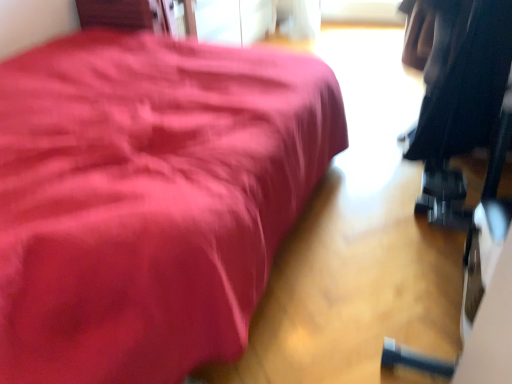
You are a GUI agent. You are given a task and a screenshot of the screen. Output one action in this format:
    pyautogui.click(x=<x>, y=<y>)
    Task: Click on the black fabric at right
    
    Given the screenshot: What is the action you would take?
    pyautogui.click(x=464, y=76)

What do you see at coordinates (464, 76) in the screenshot?
I see `black fabric at right` at bounding box center [464, 76].

What is the approximate height of matte black dumbbell at lower right?

The height of matte black dumbbell at lower right is 0.92 inches.

Find the location of `matte black dumbbell at lower right`. matte black dumbbell at lower right is located at coordinates (148, 199).

Image resolution: width=512 pixels, height=384 pixels. What do you see at coordinates (148, 199) in the screenshot?
I see `matte black dumbbell at lower right` at bounding box center [148, 199].

This screenshot has height=384, width=512. Identify the location of black fabric at right. (464, 76).

Can you confirm if black fabric at right is positioned to the right of matte black dumbbell at lower right?

Correct, you'll find black fabric at right to the right of matte black dumbbell at lower right.

Is black fabric at right positioned behind matte black dumbbell at lower right?

Yes.

Considering the positions of points (492, 29) and (82, 130), is point (492, 29) closer to camera compared to point (82, 130)?

No, it is behind (82, 130).

From the image's perspective, which one is positioned higher, black fabric at right or matte black dumbbell at lower right?

From the image's view, matte black dumbbell at lower right is above.

From a real-world perspective, between black fabric at right and matte black dumbbell at lower right, who is vertically lower?

In real-world perspective, matte black dumbbell at lower right is lower.

Which of these two, black fabric at right or matte black dumbbell at lower right, is wider?

matte black dumbbell at lower right.

Considering the sizes of black fabric at right and matte black dumbbell at lower right in the image, is black fabric at right taller or shorter than matte black dumbbell at lower right?

Clearly, black fabric at right is taller compared to matte black dumbbell at lower right.

Considering the sizes of objects black fabric at right and matte black dumbbell at lower right in the image provided, who is bigger, black fabric at right or matte black dumbbell at lower right?

With larger size is matte black dumbbell at lower right.

Which is correct: black fabric at right is inside matte black dumbbell at lower right, or outside of it?

black fabric at right is not enclosed by matte black dumbbell at lower right.

Consider the image. Is black fabric at right not close to matte black dumbbell at lower right?

black fabric at right is near matte black dumbbell at lower right, not far away.

Is black fabric at right facing away from matte black dumbbell at lower right?

No, black fabric at right's orientation is not away from matte black dumbbell at lower right.

How different are the orientations of black fabric at right and matte black dumbbell at lower right in degrees?

black fabric at right and matte black dumbbell at lower right are facing 90 degrees away from each other.

Looking at this image, how much distance is there between black fabric at right and matte black dumbbell at lower right?

They are 82.06 centimeters apart.

In order to click on clothing located behind the matte black dumbbell at lower right in this screenshot , I will do `click(464, 76)`.

Which is more to the right, matte black dumbbell at lower right or black fabric at right?

From the viewer's perspective, black fabric at right appears more on the right side.

In the image, is matte black dumbbell at lower right positioned in front of or behind black fabric at right?

In the image, matte black dumbbell at lower right appears in front of black fabric at right.

Considering the points (33, 372) and (496, 21), which point is behind, point (33, 372) or point (496, 21)?

Positioned behind is point (496, 21).

From the image's perspective, does matte black dumbbell at lower right appear lower than black fabric at right?

No.

From a real-world perspective, which is physically below, matte black dumbbell at lower right or black fabric at right?

matte black dumbbell at lower right is physically lower.

Which object is thinner, matte black dumbbell at lower right or black fabric at right?

black fabric at right is thinner.

Can you confirm if matte black dumbbell at lower right is taller than black fabric at right?

No.

Can you confirm if matte black dumbbell at lower right is smaller than black fabric at right?

No.

Based on the photo, is matte black dumbbell at lower right not within black fabric at right?

Indeed, matte black dumbbell at lower right is completely outside black fabric at right.

Is matte black dumbbell at lower right beside black fabric at right?

No.

Is matte black dumbbell at lower right looking in the opposite direction of black fabric at right?

matte black dumbbell at lower right does not have its back to black fabric at right.

What's the angular difference between matte black dumbbell at lower right and black fabric at right's facing directions?

The angular difference between matte black dumbbell at lower right and black fabric at right is 90 degrees.

The width and height of the screenshot is (512, 384). What are the coordinates of `furniture below the black fabric at right (from a real-world perspective)` in the screenshot? It's located at (148, 199).

At what (x,y) coordinates should I click in order to perform the action: click on clothing behind the matte black dumbbell at lower right. Please return your answer as a coordinate pair (x, y). This screenshot has width=512, height=384. Looking at the image, I should click on (464, 76).

You are a GUI agent. You are given a task and a screenshot of the screen. Output one action in this format:
    pyautogui.click(x=<x>, y=<y>)
    Task: Click on the furniture that appears on the left of black fabric at right
    
    Given the screenshot: What is the action you would take?
    pyautogui.click(x=148, y=199)